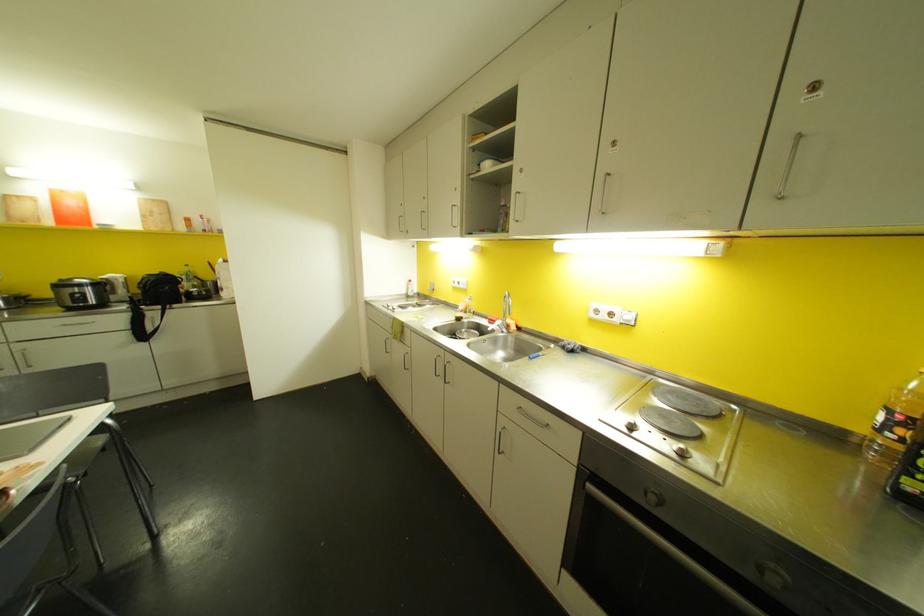
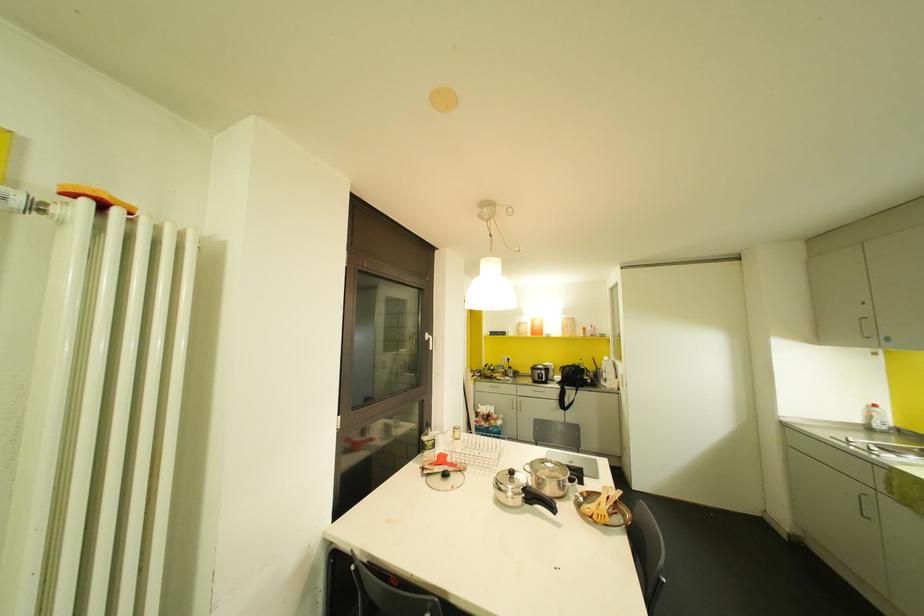
Find the pixel in the second image that matches point (73, 217) in the first image.

(536, 331)